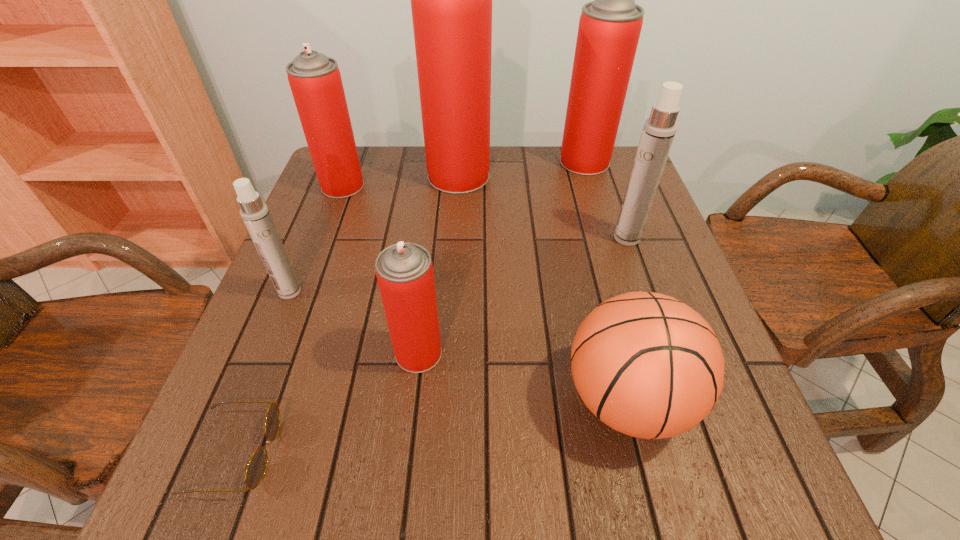
Find the location of `vacant space at the far edge of the desktop`. vacant space at the far edge of the desktop is located at coordinates (511, 191).

Locate an element on the screen. vacant area at the near edge of the desktop is located at coordinates (460, 483).

I want to click on free space at the left edge of the desktop, so click(267, 339).

Find the location of `vacant region at the right edge of the desktop`. vacant region at the right edge of the desktop is located at coordinates (662, 284).

Find the location of a particular element. This screenshot has width=960, height=540. vacant space at the near right corner is located at coordinates (691, 456).

You are a GUI agent. You are given a task and a screenshot of the screen. Output one action in this format:
    pyautogui.click(x=<x>, y=<y>)
    Task: Click on the blank region between the tallest object and the fourth farthest aerosol can
    
    Given the screenshot: What is the action you would take?
    pyautogui.click(x=542, y=207)

Locate an element on the screen. This screenshot has width=960, height=540. free space that is in between the basketball and the gray sunglasses is located at coordinates (431, 426).

Where is `empty location between the nearest red aerosol can and the second shortest object`? Image resolution: width=960 pixels, height=540 pixels. empty location between the nearest red aerosol can and the second shortest object is located at coordinates (523, 376).

Where is `free space between the gray sunglasses and the nearest aerosol can`? free space between the gray sunglasses and the nearest aerosol can is located at coordinates pyautogui.click(x=327, y=402).

This screenshot has height=540, width=960. I want to click on free area in between the nearest aerosol can and the shortest object, so click(327, 402).